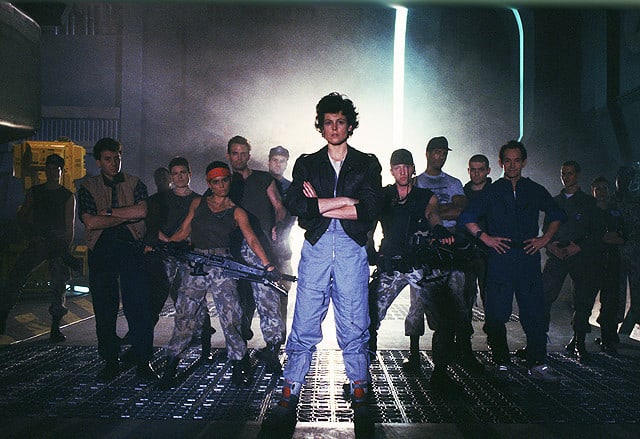
At what (x,y) coordinates should I click in order to perform the action: click on grate. Please return your answer as a coordinate pair (x, y). Looking at the image, I should click on (416, 406).